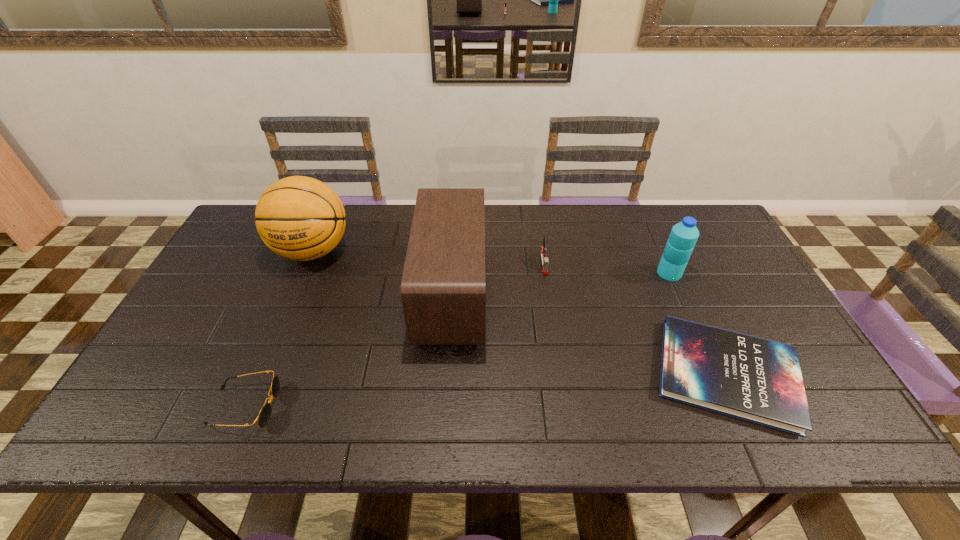
The height and width of the screenshot is (540, 960). I want to click on free space between the sunglasses and the basketball, so click(x=278, y=329).

At what (x,y) coordinates should I click in order to perform the action: click on free space between the radio receiver and the water bottle. Please return your answer as a coordinate pair (x, y). Image resolution: width=960 pixels, height=540 pixels. Looking at the image, I should click on (561, 283).

Locate an element on the screen. free space between the water bottle and the third shortest object is located at coordinates (607, 268).

Locate an element on the screen. Image resolution: width=960 pixels, height=540 pixels. free space that is in between the radio receiver and the hardback book is located at coordinates (589, 334).

Where is `vacant area that lies between the second shortest object and the third object from right to left`? The image size is (960, 540). vacant area that lies between the second shortest object and the third object from right to left is located at coordinates (395, 335).

Image resolution: width=960 pixels, height=540 pixels. I want to click on object that is the third closest to the fourth shortest object, so click(x=443, y=284).

Locate which object ranks second in proximity to the hardback book. Please provide its 2D coordinates. Your answer should be formatted as a tuple, i.e. [(x, y)], where the tuple contains the x and y coordinates of a point satisfying the conditions above.

[(543, 252)]

Identify the location of free point that satisfies the following two spatial constraints: 1. on the front-facing side of the shortest object; 2. on the right side of the radio receiver. The height and width of the screenshot is (540, 960). (446, 374).

Locate an element on the screen. vacant space that satisfies the following two spatial constraints: 1. on the front-facing side of the radio receiver; 2. on the right side of the shortest object is located at coordinates (446, 374).

Identify the location of free space that satisfies the following two spatial constraints: 1. on the back side of the shortest object; 2. on the front-facing side of the fourth object from right to left. The image size is (960, 540). (689, 293).